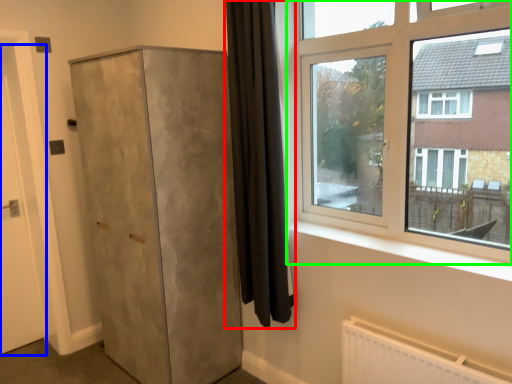
Question: Which is nearer to the curtain (highlighted by a red box)? door (highlighted by a blue box) or window (highlighted by a green box).

Choices:
 (A) door
 (B) window

Answer: (B)